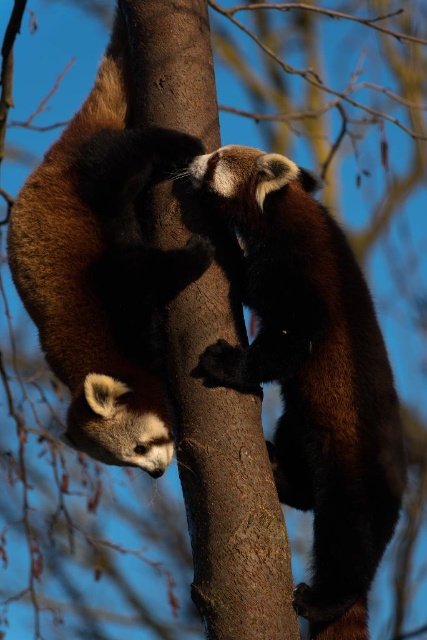
Question: Is the position of brown furry panda at center less distant than that of brown furry panda at left?

Choices:
 (A) no
 (B) yes

Answer: (A)

Question: Does brown furry panda at center appear on the left side of brown furry panda at left?

Choices:
 (A) no
 (B) yes

Answer: (A)

Question: Which point is farther to the camera?

Choices:
 (A) (149, 332)
 (B) (348, 314)

Answer: (A)

Question: Which point appears closest to the camera in this image?

Choices:
 (A) (292, 342)
 (B) (163, 436)

Answer: (B)

Question: Which point appears farthest from the camera in this image?

Choices:
 (A) (146, 330)
 (B) (344, 340)

Answer: (A)

Question: Does brown furry panda at center appear over brown furry panda at left?

Choices:
 (A) no
 (B) yes

Answer: (A)